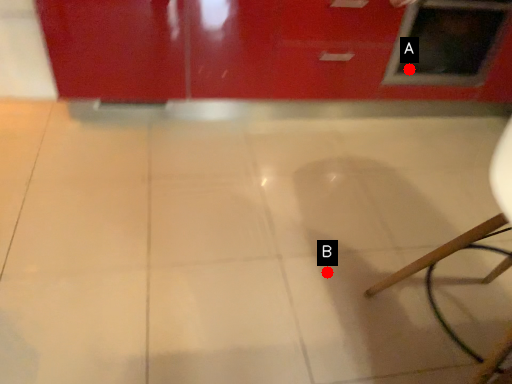
Question: Two points are circled on the image, labeled by A and B beside each circle. Which point is closer to the camera?

Choices:
 (A) A is closer
 (B) B is closer

Answer: (B)